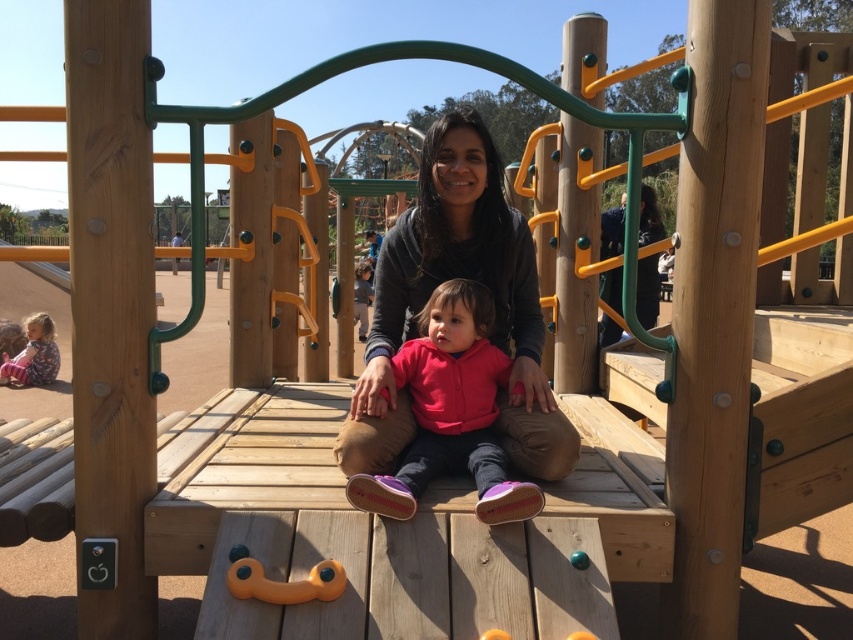
Question: Does pink fleece jacket at center appear on the left side of matte pink jacket at lower left?

Choices:
 (A) no
 (B) yes

Answer: (A)

Question: Which point is farther to the camera?

Choices:
 (A) pink fleece jacket at center
 (B) matte black hoodie at center
 (C) matte pink jacket at lower left

Answer: (C)

Question: Does pink fleece jacket at center lie in front of matte pink jacket at lower left?

Choices:
 (A) no
 (B) yes

Answer: (B)

Question: Which object is closer to the camera taking this photo?

Choices:
 (A) matte pink jacket at lower left
 (B) pink fleece jacket at center
 (C) matte black hoodie at center

Answer: (B)

Question: Observing the image, what is the correct spatial positioning of matte black hoodie at center in reference to matte pink jacket at lower left?

Choices:
 (A) below
 (B) above

Answer: (B)

Question: Which point is closer to the camera taking this photo?

Choices:
 (A) (363, 426)
 (B) (7, 365)
 (C) (491, 401)

Answer: (A)